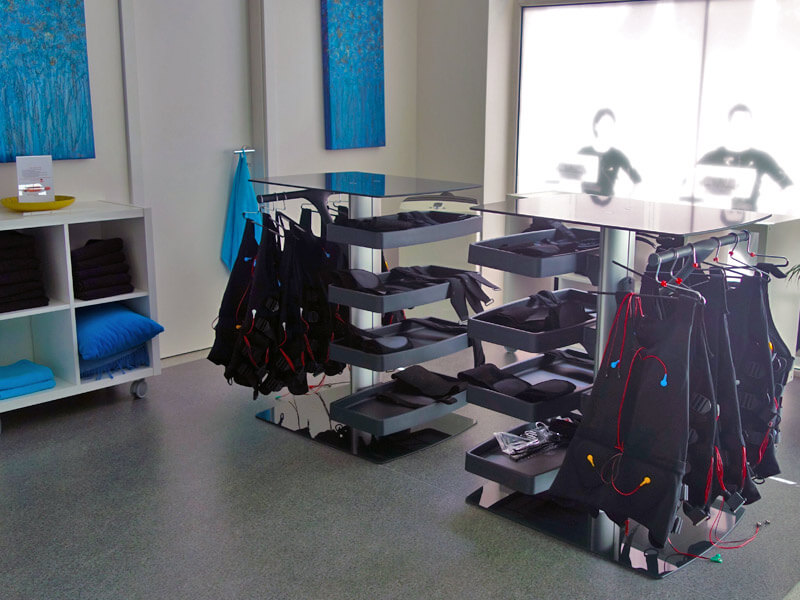
Find the location of a particular element. Image resolution: width=800 pixels, height=600 pixels. yellow bowl is located at coordinates (30, 206).